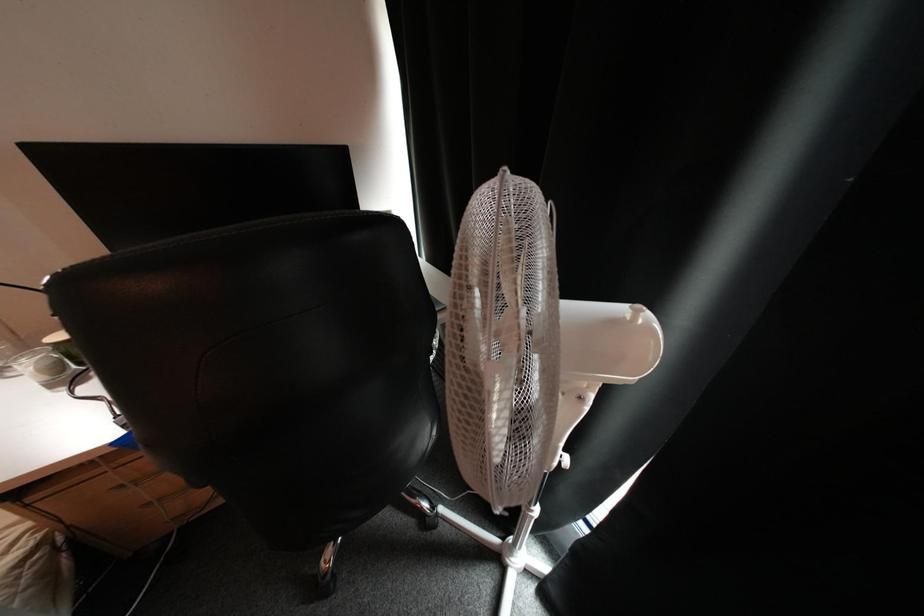
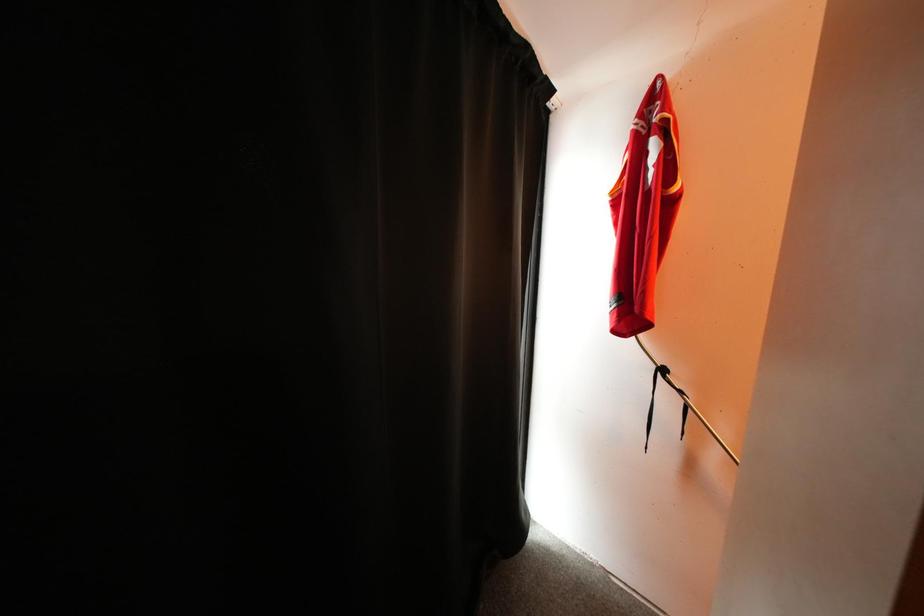
Question: The first image is from the beginning of the video and the second image is from the end. How did the camera likely rotate when shooting the video?

Choices:
 (A) Left
 (B) Right
 (C) Up
 (D) Down

Answer: (B)